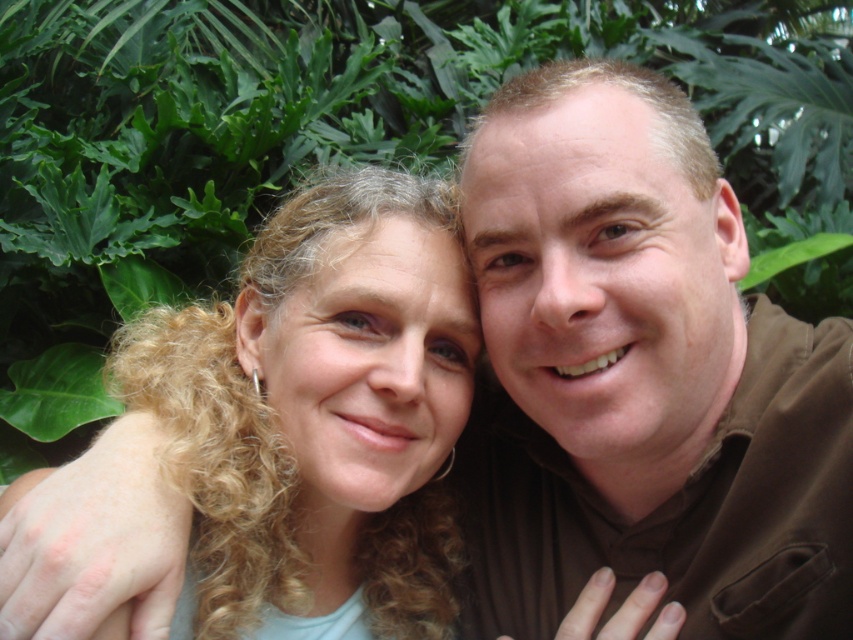
You are a photographer trying to adjust the lighting for a portrait. You notice the brown smooth shirt at center is at point (642,376). Where should you position your reflector to best illuminate the shirt?

The brown smooth shirt at center is located at point (642,376). To best illuminate it, position the reflector opposite the natural light source, which is likely coming from the direction of the camera, to bounce light onto the shirt at that coordinate.

You are a photographer adjusting the camera focus. The camera can only focus on objects within a 15 cm range. Given the distance between the brown smooth shirt at center and the curly blonde hair at center, will both subjects be in focus?

The distance between the brown smooth shirt at center and the curly blonde hair at center is 19.08 centimeters. Since the camera can only focus within a 15 cm range, the two subjects are outside this range, so they won cannot both be in focus.

You are a photographer trying to capture a closeup shot of both the brown smooth shirt at center and the curly blonde hair at center. Since you want to ensure both are clearly visible, which object should you focus on first considering their sizes?

The brown smooth shirt at center is larger than the curly blonde hair at center, so you should focus on the brown smooth shirt at center first to ensure it is in sharp focus before adjusting for the smaller curly blonde hair at center.